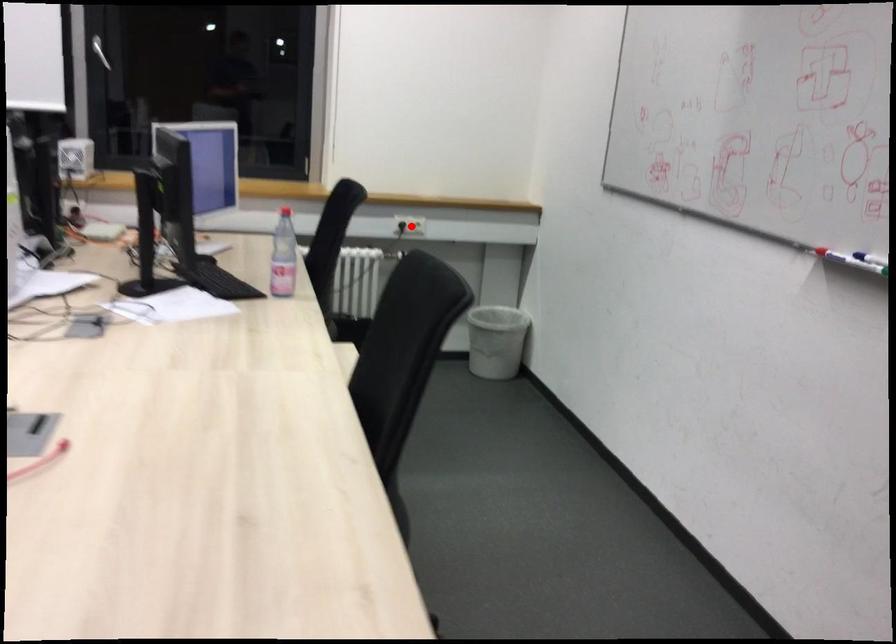
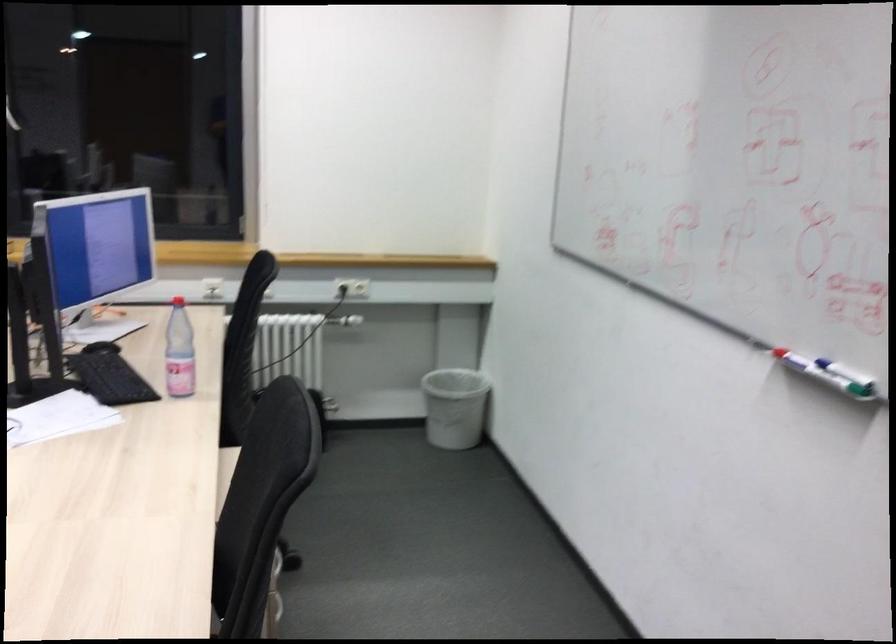
In the second image, find the point that corresponds to the highlighted location in the first image.

(352, 287)